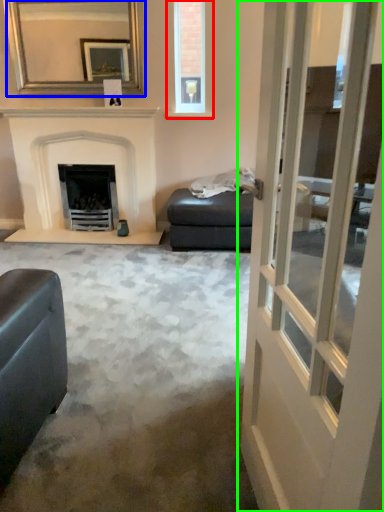
Question: Considering the real-world distances, which object is farthest from window (highlighted by a red box)? mirror (highlighted by a blue box) or door (highlighted by a green box)?

Choices:
 (A) mirror
 (B) door

Answer: (B)